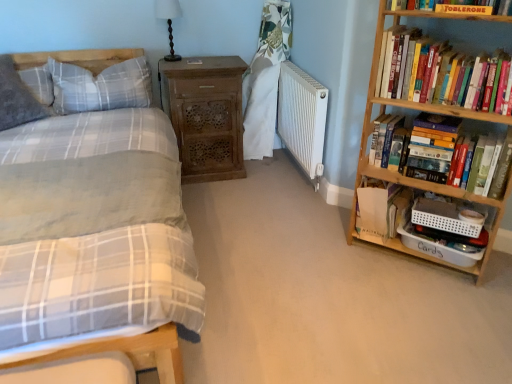
Identify the location of vacant space to the left of wooden bookshelf at right. Image resolution: width=512 pixels, height=384 pixels. (331, 257).